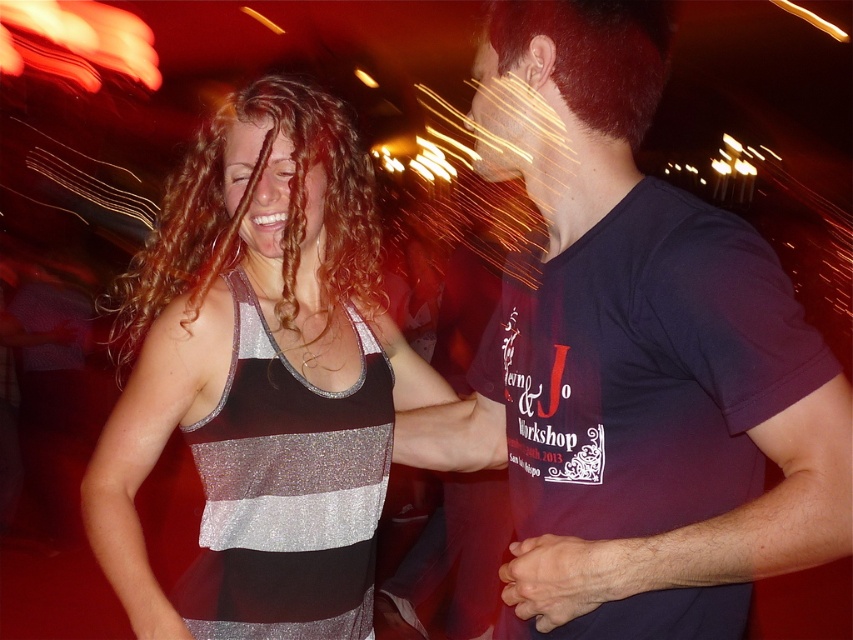
Question: Can you confirm if shiny silver tank top at center is positioned to the right of dark brown hair at upper right?

Choices:
 (A) yes
 (B) no

Answer: (B)

Question: Estimate the real-world distances between objects in this image. Which object is farther from the dark brown hair at upper right?

Choices:
 (A) smooth skin hand at center
 (B) dark blue t-shirt at center
 (C) shiny silver tank top at center
 (D) curly brown hair at left

Answer: (A)

Question: Which point is closer to the camera?

Choices:
 (A) smooth skin hand at center
 (B) curly brown hair at left
 (C) dark brown hair at upper right
 (D) dark blue t-shirt at center

Answer: (D)

Question: Can you confirm if dark blue t-shirt at center is positioned to the left of smooth skin hand at center?

Choices:
 (A) yes
 (B) no

Answer: (A)

Question: Which object is closer to the camera taking this photo?

Choices:
 (A) shiny silver tank top at center
 (B) dark blue t-shirt at center
 (C) smooth skin hand at center
 (D) dark brown hair at upper right

Answer: (B)

Question: Can you confirm if dark blue t-shirt at center is positioned to the left of curly brown hair at left?

Choices:
 (A) no
 (B) yes

Answer: (A)